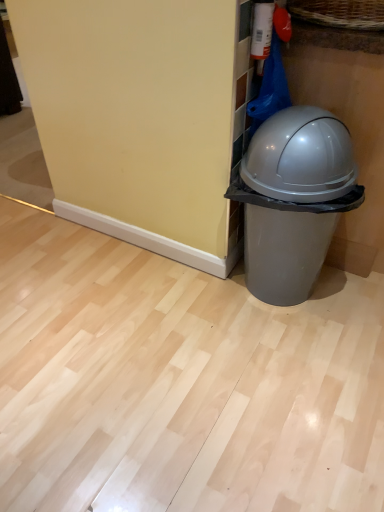
Identify the location of gray matte plastic trash can at right. Image resolution: width=384 pixels, height=512 pixels. (293, 200).

What is the approximate height of gray matte plastic trash can at right?

gray matte plastic trash can at right is 29.38 inches in height.

The height and width of the screenshot is (512, 384). What do you see at coordinates (293, 200) in the screenshot? I see `gray matte plastic trash can at right` at bounding box center [293, 200].

This screenshot has width=384, height=512. What are the coordinates of `gray matte plastic trash can at right` in the screenshot? It's located at (293, 200).